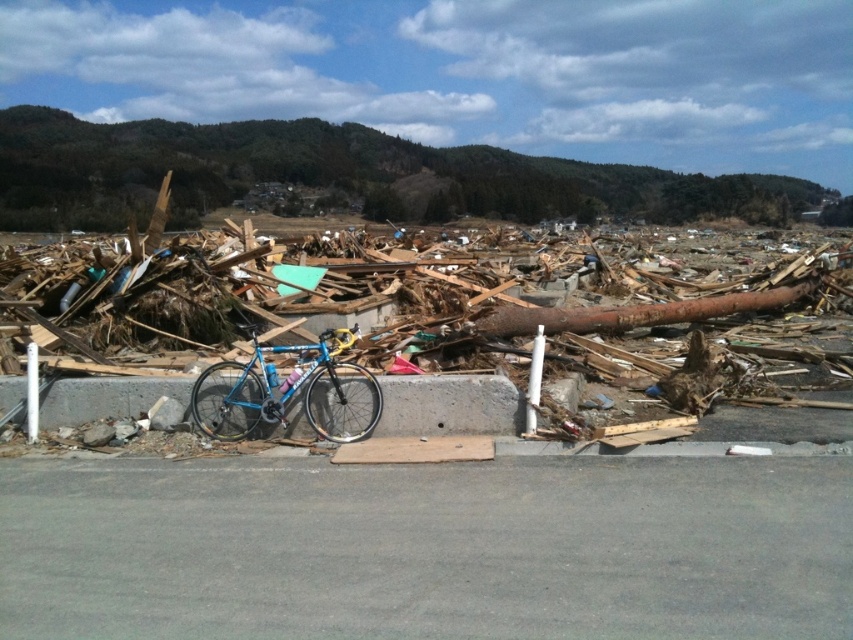
Question: Does concrete at center appear on the left side of rusty metal log at center?

Choices:
 (A) yes
 (B) no

Answer: (A)

Question: Which of the following is the farthest from the observer?

Choices:
 (A) (523, 310)
 (B) (409, 378)
 (C) (329, 440)

Answer: (A)

Question: Which object appears closest to the camera in this image?

Choices:
 (A) shiny blue frame bicycle at center
 (B) concrete at center

Answer: (A)

Question: Is concrete at center below shiny blue frame bicycle at center?

Choices:
 (A) yes
 (B) no

Answer: (A)

Question: Is concrete at center closer to camera compared to shiny blue frame bicycle at center?

Choices:
 (A) no
 (B) yes

Answer: (A)

Question: Which object appears closest to the camera in this image?

Choices:
 (A) concrete at center
 (B) shiny blue frame bicycle at center
 (C) rusty metal log at center

Answer: (B)